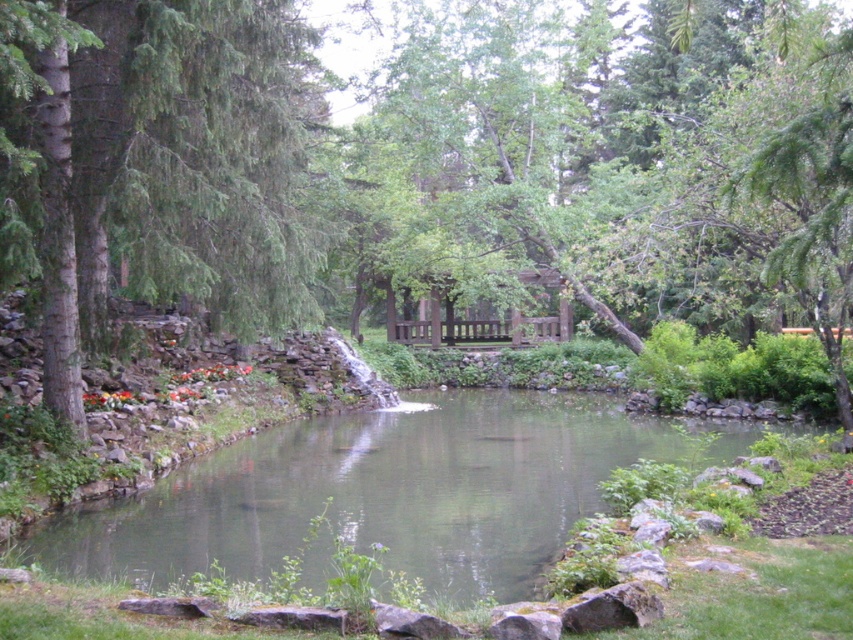
You are planning to plant a new tree in this garden. The green leafy tree at center and the green evergreen tree at left are already present. Which tree would you consider replacing if you want to make space for a smaller tree?

The green evergreen tree at left is smaller than the green leafy tree at center, so you should consider replacing the green evergreen tree at left to make space for a smaller tree.

You are standing at the edge of the pond and want to take a photo of the green leafy tree at center. If your camera has a maximum focus range of 6 meters, will it be able to capture the tree clearly?

The green leafy tree at center is 5.96 meters away from the viewer. Since the camera can focus up to 6 meters, it will be able to capture the tree clearly within its range.

You are standing at the edge of the pond and want to take a photo of the green leafy tree at center. Based on its coordinates, where should you position yourself to ensure the tree is centered in your camera view?

The green leafy tree at center is located at coordinates point [431,170]. To center it in your camera view, position yourself so that the tree aligns with the center point of your camera frame at those coordinates.